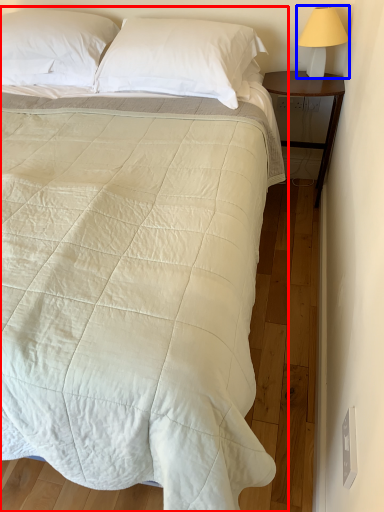
Question: Which object appears farthest to the camera in this image, bed (highlighted by a red box) or bedside lamp (highlighted by a blue box)?

Choices:
 (A) bed
 (B) bedside lamp

Answer: (B)